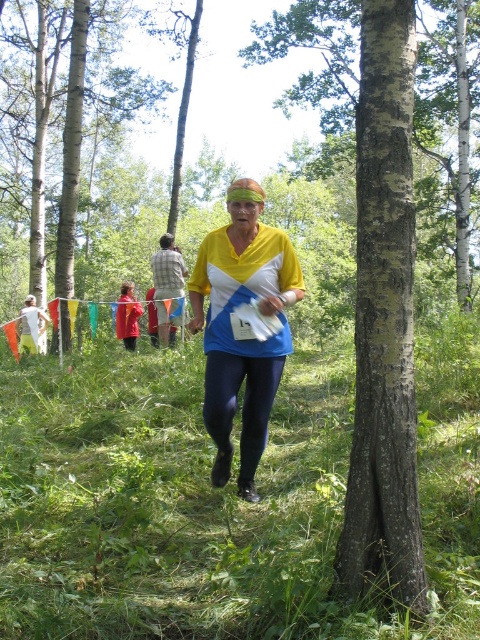
Question: Does green bark tree at center have a greater width compared to brown bark tree at upper left?

Choices:
 (A) yes
 (B) no

Answer: (A)

Question: Which of the following is the closest to the observer?

Choices:
 (A) white paper at left
 (B) plaid fabric shirt at center
 (C) red fabric jacket at center

Answer: (A)

Question: Does plaid fabric shirt at center have a larger size compared to red fabric jacket at center?

Choices:
 (A) yes
 (B) no

Answer: (A)

Question: In this image, where is plaid fabric shirt at center located relative to white paper at left?

Choices:
 (A) below
 (B) above

Answer: (B)

Question: Which point is farther to the camera?

Choices:
 (A) (197, 300)
 (B) (352, 26)
 (C) (117, 83)

Answer: (B)

Question: Estimate the real-world distances between objects in this image. Which object is closer to the white paper at left?

Choices:
 (A) red fabric jacket at center
 (B) yellow fabric shirt at center
 (C) brown bark tree at upper left

Answer: (A)